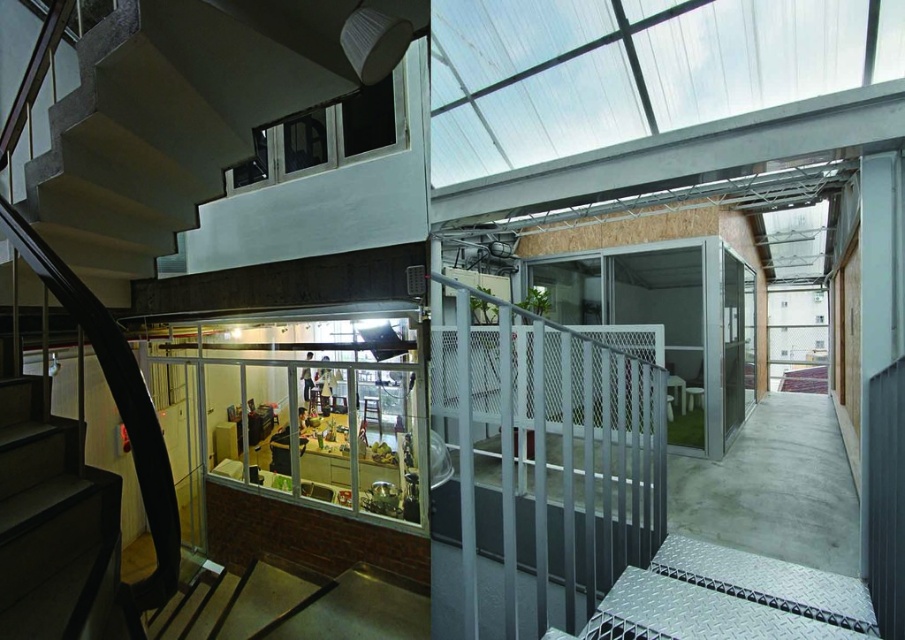
Does metallic mesh railing at center have a smaller size compared to concrete stairs at lower left?

Incorrect, metallic mesh railing at center is not smaller in size than concrete stairs at lower left.

Is metallic mesh railing at center to the left of concrete stairs at lower left from the viewer's perspective?

Incorrect, metallic mesh railing at center is not on the left side of concrete stairs at lower left.

Who is more distant from viewer, (664, 381) or (53, 486)?

The point (664, 381) is behind.

Locate an element on the screen. The image size is (905, 640). metallic mesh railing at center is located at coordinates (538, 470).